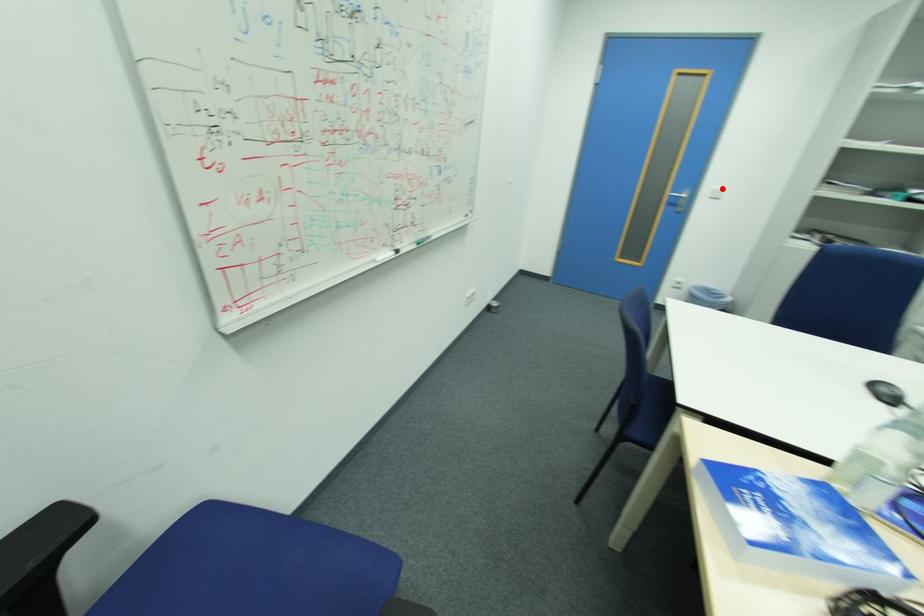
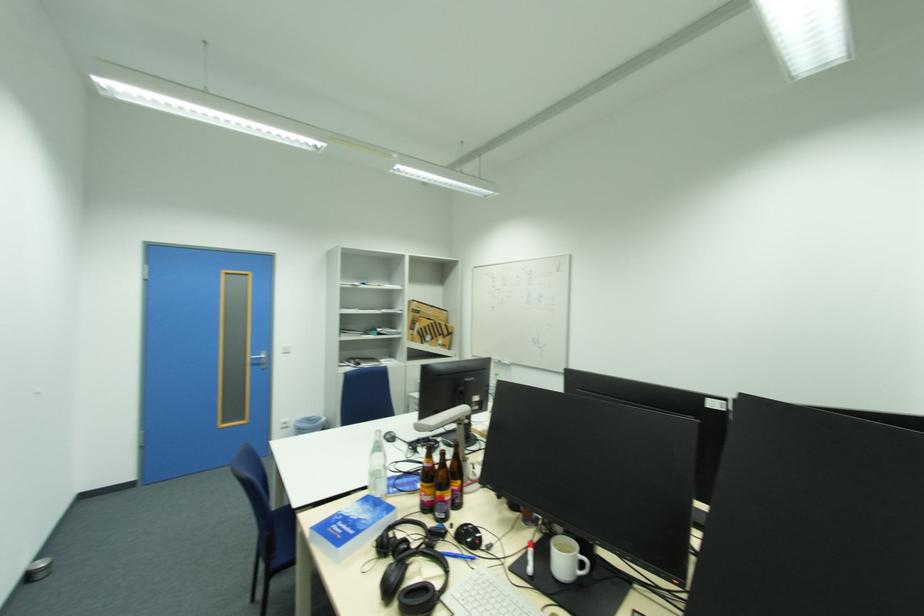
Find the pixel in the second image that matches the highlighted location in the first image.

(289, 347)